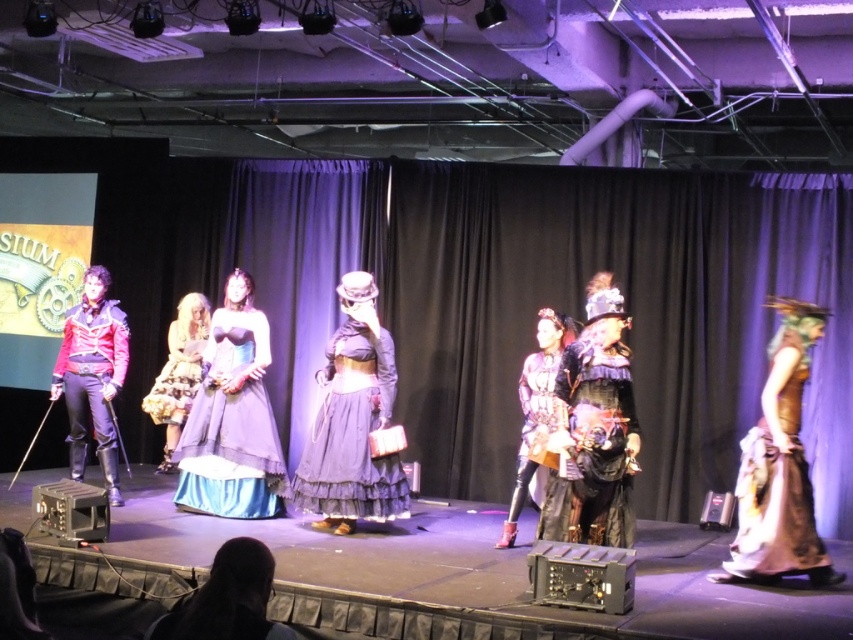
Question: Which object is the closest to the steampunk-inspired armor at center?

Choices:
 (A) blue satin dress at center
 (B) leather-like black dress at center

Answer: (B)

Question: Which point is farther to the camera?

Choices:
 (A) shiny leather jacket at left
 (B) steampunk-inspired armor at center

Answer: (A)

Question: Is blue satin dress at center bigger than steampunk-inspired armor at center?

Choices:
 (A) no
 (B) yes

Answer: (B)

Question: Does blue satin dress at center lie in front of leather-like black dress at center?

Choices:
 (A) yes
 (B) no

Answer: (B)

Question: From the image, what is the correct spatial relationship of blue satin dress at center in relation to leather-like black dress at center?

Choices:
 (A) right
 (B) left

Answer: (B)

Question: Which object appears closest to the camera in this image?

Choices:
 (A) gray satin dress at center
 (B) shiny leather jacket at left
 (C) blue satin dress at center

Answer: (A)